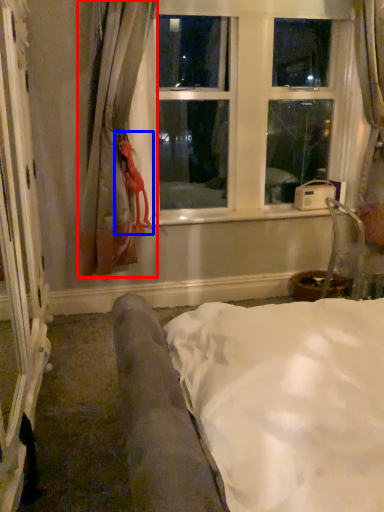
Question: Which point is closer to the camera, curtain (highlighted by a red box) or doll (highlighted by a blue box)?

Choices:
 (A) curtain
 (B) doll

Answer: (A)